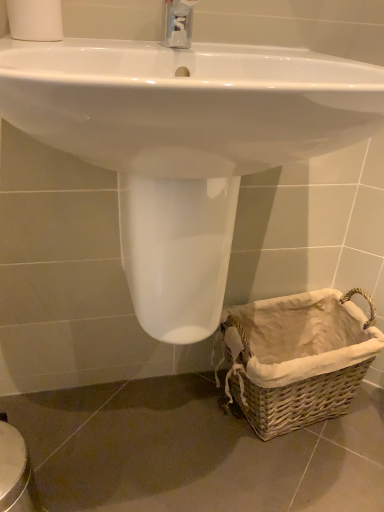
Question: Is white glossy sink at center bigger or smaller than woven brown basket at lower right?

Choices:
 (A) small
 (B) big

Answer: (B)

Question: Based on their positions, is white glossy sink at center located to the left or right of woven brown basket at lower right?

Choices:
 (A) left
 (B) right

Answer: (A)

Question: Estimate the real-world distances between objects in this image. Which object is farther from the white matte toilet paper at upper left?

Choices:
 (A) woven brown basket at lower right
 (B) white glossy sink at center

Answer: (A)

Question: Estimate the real-world distances between objects in this image. Which object is closer to the woven brown basket at lower right?

Choices:
 (A) white glossy sink at center
 (B) white matte toilet paper at upper left

Answer: (A)